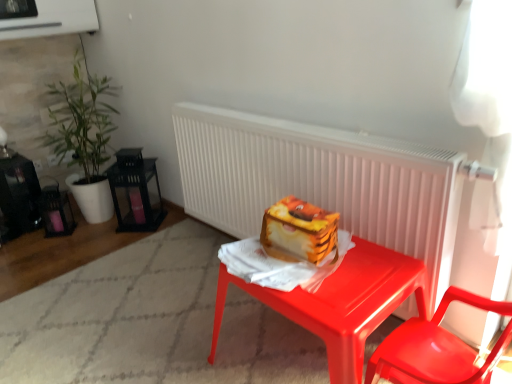
Question: Do you think glossy plastic desk at center is within white matte radiator at center, or outside of it?

Choices:
 (A) outside
 (B) inside

Answer: (A)

Question: Considering the relative positions of glossy plastic desk at center and white matte radiator at center in the image provided, is glossy plastic desk at center to the left or to the right of white matte radiator at center?

Choices:
 (A) left
 (B) right

Answer: (B)

Question: Estimate the real-world distances between objects in this image. Which object is closer to the white matte radiator at center?

Choices:
 (A) green leafy plant at left
 (B) glossy plastic desk at center
 (C) glossy plastic chair at lower right

Answer: (B)

Question: Based on their relative distances, which object is farther from the green leafy plant at left?

Choices:
 (A) glossy plastic chair at lower right
 (B) white matte radiator at center
 (C) glossy plastic desk at center

Answer: (A)